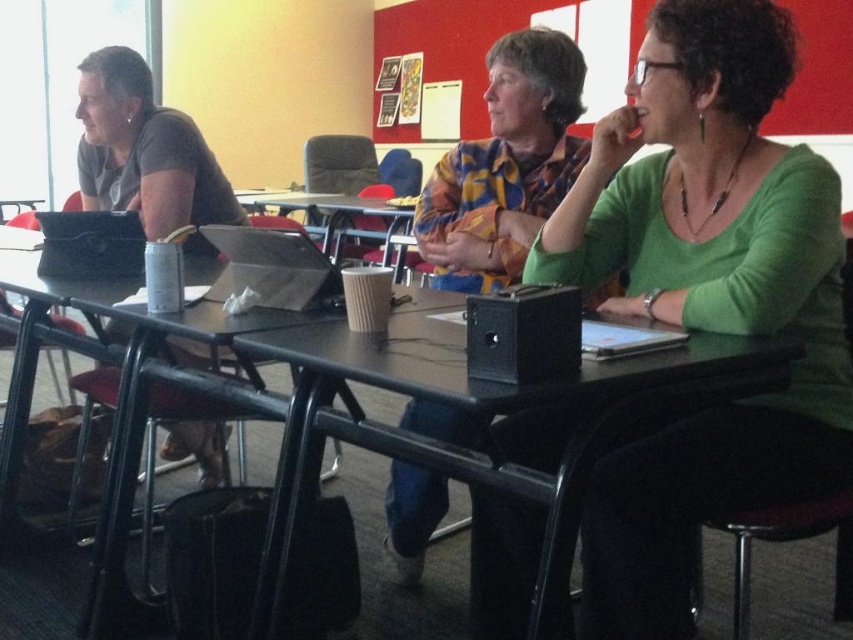
Question: Is green matte shirt at center positioned before floral shirt at center?

Choices:
 (A) yes
 (B) no

Answer: (A)

Question: Does green matte shirt at center have a larger size compared to matte silver laptop at center?

Choices:
 (A) yes
 (B) no

Answer: (A)

Question: Which is farther from the brown paper cup at center?

Choices:
 (A) matte gray shirt at left
 (B) green matte shirt at center

Answer: (B)

Question: Which point is farther to the camera?

Choices:
 (A) (732, 344)
 (B) (825, 476)

Answer: (B)

Question: In this image, where is matte gray shirt at left located relative to brown paper cup at center?

Choices:
 (A) below
 (B) above

Answer: (A)

Question: Which of the following is the closest to the observer?

Choices:
 (A) click(x=334, y=250)
 (B) click(x=514, y=166)
 (C) click(x=763, y=362)

Answer: (C)